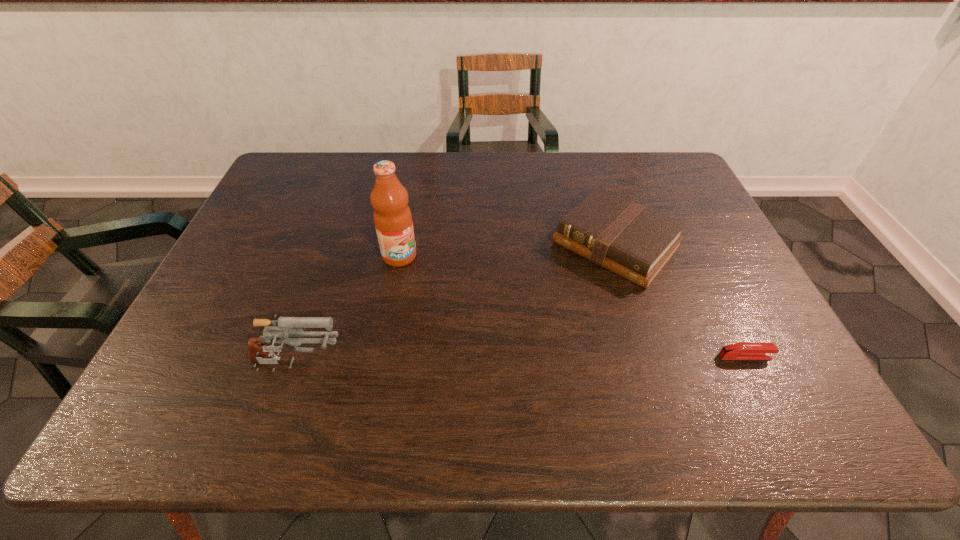
You are a GUI agent. You are given a task and a screenshot of the screen. Output one action in this format:
    pyautogui.click(x=<x>, y=<y>)
    Task: Click on the second tallest object
    The height and width of the screenshot is (540, 960).
    Given the screenshot: What is the action you would take?
    pyautogui.click(x=283, y=328)

Where is `gun`? This screenshot has height=540, width=960. gun is located at coordinates tap(283, 328).

This screenshot has width=960, height=540. In order to click on the shortest object in this screenshot , I will do `click(744, 350)`.

Find the location of a particular element. The width and height of the screenshot is (960, 540). the second object from left to right is located at coordinates (392, 216).

Where is `the tallest object`? The image size is (960, 540). the tallest object is located at coordinates (392, 216).

At what (x,y) coordinates should I click in order to perform the action: click on the second shortest object. Please return your answer as a coordinate pair (x, y). The height and width of the screenshot is (540, 960). Looking at the image, I should click on (634, 242).

Where is `vacant space located at the barrel end of the gun`? vacant space located at the barrel end of the gun is located at coordinates (422, 367).

This screenshot has width=960, height=540. I want to click on blank area located 0.140m on the front label of the fruit juice, so click(445, 293).

Image resolution: width=960 pixels, height=540 pixels. I want to click on blank space located on the front label of the fruit juice, so click(x=482, y=322).

Where is `free spot located 0.130m on the front label of the fruit juice`? The image size is (960, 540). free spot located 0.130m on the front label of the fruit juice is located at coordinates (443, 291).